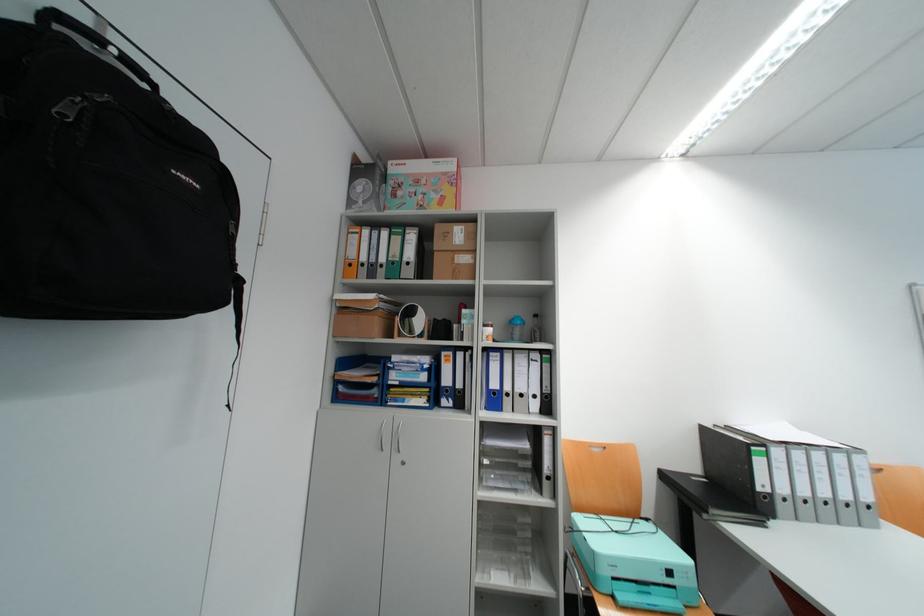
Locate an element on the screen. The width and height of the screenshot is (924, 616). blue binder spine hole is located at coordinates (492, 391).